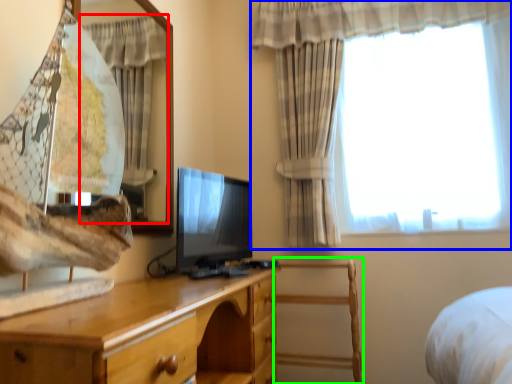
Question: Based on their relative distances, which object is farther from curtain (highlighted by a red box)? Choose from curtain (highlighted by a blue box) and chair (highlighted by a green box).

Choices:
 (A) curtain
 (B) chair

Answer: (B)